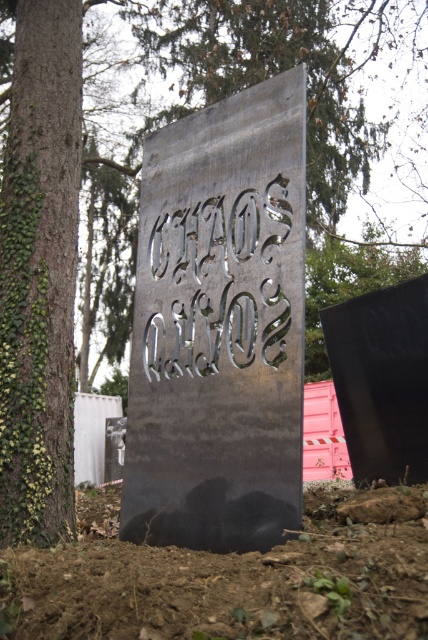
Can you confirm if metallic gray sign at center is positioned above brushed metal sign at center?

Actually, metallic gray sign at center is below brushed metal sign at center.

What do you see at coordinates (219, 326) in the screenshot? The height and width of the screenshot is (640, 428). I see `metallic gray sign at center` at bounding box center [219, 326].

The height and width of the screenshot is (640, 428). Find the location of `metallic gray sign at center`. metallic gray sign at center is located at coordinates (219, 326).